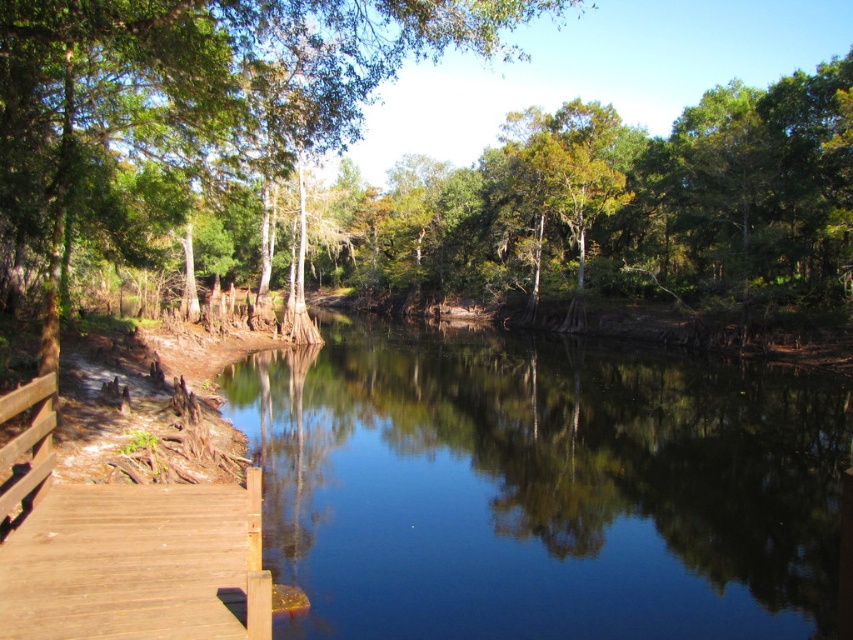
Question: Which is farther from the brown wooden dock at lower left?

Choices:
 (A) green leafy tree at center
 (B) clear water at center

Answer: (A)

Question: Considering the real-world distances, which object is closest to the green leafy tree at center?

Choices:
 (A) clear water at center
 (B) brown wooden dock at lower left

Answer: (A)

Question: Which point is closer to the camera taking this photo?

Choices:
 (A) (247, 481)
 (B) (242, 163)
 (C) (525, 454)

Answer: (A)

Question: Can you confirm if clear water at center is bigger than green leafy tree at center?

Choices:
 (A) yes
 (B) no

Answer: (B)

Question: Can you confirm if green leafy tree at center is positioned above brown wooden dock at lower left?

Choices:
 (A) yes
 (B) no

Answer: (A)

Question: Does clear water at center appear under green leafy tree at center?

Choices:
 (A) no
 (B) yes

Answer: (B)